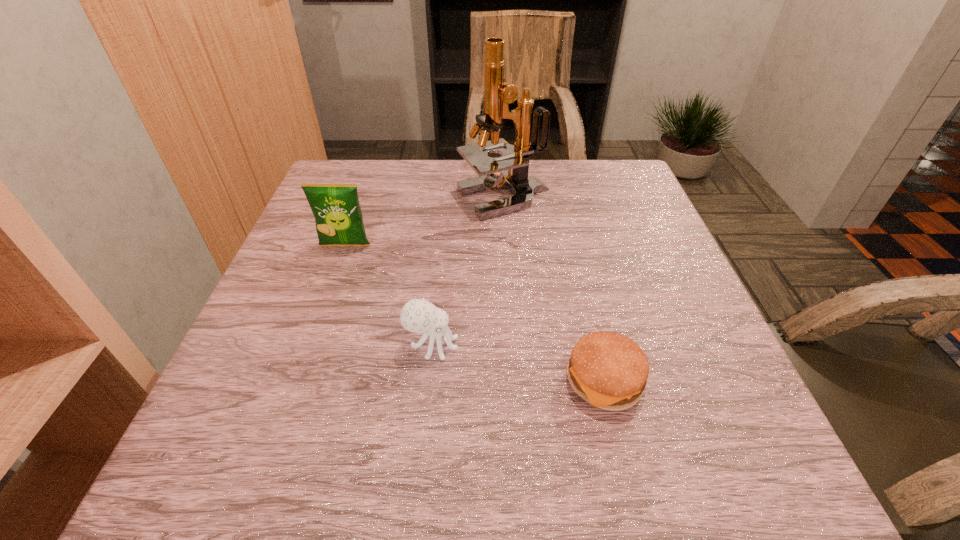
Where is `free point between the third tallest object and the crisp (potato chip)`? free point between the third tallest object and the crisp (potato chip) is located at coordinates (389, 295).

This screenshot has height=540, width=960. What are the coordinates of `unoccupied area between the microscope and the crisp (potato chip)` in the screenshot? It's located at (424, 222).

Locate an element on the screen. The image size is (960, 540). unoccupied area between the second tallest object and the hamburger is located at coordinates (475, 313).

This screenshot has height=540, width=960. Identify the location of vacant space that is in between the third shortest object and the shortest object. (475, 313).

This screenshot has width=960, height=540. In order to click on vacant area that lies between the second shortest object and the farthest object in this screenshot , I will do `click(468, 272)`.

Identify the location of free spot between the hamburger and the third tallest object. This screenshot has height=540, width=960. (518, 363).

Where is `vacant area that lies between the hamburger and the tallest object`? Image resolution: width=960 pixels, height=540 pixels. vacant area that lies between the hamburger and the tallest object is located at coordinates (554, 290).

What are the coordinates of `free space between the octopus and the shortest object` in the screenshot? It's located at (518, 363).

I want to click on free space between the hamburger and the crisp (potato chip), so click(475, 313).

Identify the location of vacant area that lies between the shortest object and the octopus. Image resolution: width=960 pixels, height=540 pixels. (518, 363).